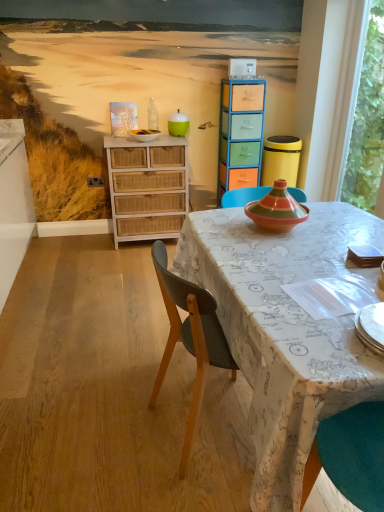
Identify the location of white glossy bowl at upper center. The height and width of the screenshot is (512, 384). (144, 135).

Find the location of a particular element. The width and height of the screenshot is (384, 512). white wicker dresser at left is located at coordinates (147, 187).

What do you see at coordinates (366, 119) in the screenshot?
I see `transparent glass window at right` at bounding box center [366, 119].

What do you see at coordinates (95, 181) in the screenshot? This screenshot has height=512, width=384. I see `black plastic power outlet at lower left` at bounding box center [95, 181].

What do you see at coordinates (153, 116) in the screenshot?
I see `translucent glass bottle at center` at bounding box center [153, 116].

Where is `multicolored painted drawers at center`? The height and width of the screenshot is (512, 384). multicolored painted drawers at center is located at coordinates (240, 134).

Is there a large distance between map-patterned fabric at center and transparent glass window at right?

Yes.

Based on the photo, between map-patterned fabric at center and transparent glass window at right, which one has less height?

map-patterned fabric at center.

Is map-patterned fabric at center located outside transparent glass window at right?

Yes.

In terms of height, does translucent glass bottle at center look taller or shorter compared to map-patterned fabric at center?

Considering their sizes, translucent glass bottle at center has less height than map-patterned fabric at center.

From the picture: Is translucent glass bottle at center to the left of map-patterned fabric at center from the viewer's perspective?

Correct, you'll find translucent glass bottle at center to the left of map-patterned fabric at center.

Who is smaller, translucent glass bottle at center or map-patterned fabric at center?

Smaller between the two is translucent glass bottle at center.

How different are the orientations of translucent glass bottle at center and map-patterned fabric at center in degrees?

translucent glass bottle at center and map-patterned fabric at center are facing 86 degrees away from each other.

What's the angular difference between black plastic power outlet at lower left and white plastic corded phone at upper center's facing directions?

The angular difference between black plastic power outlet at lower left and white plastic corded phone at upper center is 2.49 degrees.

From a real-world perspective, is black plastic power outlet at lower left on white plastic corded phone at upper center?

No, from a real-world perspective, black plastic power outlet at lower left is not above white plastic corded phone at upper center.

Does black plastic power outlet at lower left lie behind white plastic corded phone at upper center?

Yes.

You are a GUI agent. You are given a task and a screenshot of the screen. Output one action in this format:
    pyautogui.click(x=<x>, y=<y>)
    Task: Click on the power outlet on the left of white plastic corded phone at upper center
    This screenshot has height=512, width=384.
    Given the screenshot: What is the action you would take?
    pyautogui.click(x=95, y=181)

Which point is more distant from viewer, (364, 99) or (234, 73)?

The point (234, 73) is more distant.

Do you think transparent glass window at right is within white plastic corded phone at upper center, or outside of it?

transparent glass window at right cannot be found inside white plastic corded phone at upper center.

Find the location of `window screen in front of the white plastic corded phone at upper center`. window screen in front of the white plastic corded phone at upper center is located at coordinates (366, 119).

From the image's perspective, is multicolored painted drawers at center located above or below black plastic power outlet at lower left?

Based on their image positions, multicolored painted drawers at center is located above black plastic power outlet at lower left.

Where is `cabinetry that appears in front of the black plastic power outlet at lower left`? The height and width of the screenshot is (512, 384). cabinetry that appears in front of the black plastic power outlet at lower left is located at coordinates (240, 134).

Are multicolored painted drawers at center and black plastic power outlet at lower left beside each other?

multicolored painted drawers at center and black plastic power outlet at lower left are not in contact.

Does point (219, 129) come in front of point (99, 182)?

Yes, it is in front of point (99, 182).

From a real-world perspective, is translucent glass bottle at center below black plastic power outlet at lower left?

Actually, translucent glass bottle at center is physically above black plastic power outlet at lower left in the real world.

Is point (151, 102) less distant than point (89, 183)?

Yes, it is in front of point (89, 183).

In the scene shown: How distant is translucent glass bottle at center from black plastic power outlet at lower left?

They are 67.16 centimeters apart.

Does translucent glass bottle at center have a smaller size compared to black plastic power outlet at lower left?

No.

From a real-world perspective, which is physically above, white plastic corded phone at upper center or black plastic power outlet at lower left?

In real-world perspective, white plastic corded phone at upper center is above.

Where is `power outlet that is below the white plastic corded phone at upper center (from the image's perspective)`? This screenshot has width=384, height=512. power outlet that is below the white plastic corded phone at upper center (from the image's perspective) is located at coordinates (95, 181).

Between point (240, 67) and point (100, 184), which one is positioned in front?

The point (240, 67) is closer to the camera.

From the image's perspective, is white plastic corded phone at upper center located beneath black plastic power outlet at lower left?

No, from the image's perspective, white plastic corded phone at upper center is not below black plastic power outlet at lower left.

The width and height of the screenshot is (384, 512). What are the coordinates of `window screen above the map-patterned fabric at center (from the image's perspective)` in the screenshot? It's located at (366, 119).

You are a GUI agent. You are given a task and a screenshot of the screen. Output one action in this format:
    pyautogui.click(x=<x>, y=<y>)
    Task: Click on the bottle lying behind the map-patterned fabric at center
    
    Given the screenshot: What is the action you would take?
    pyautogui.click(x=153, y=116)

Which object lies further to the anchor point white plastic corded phone at upper center, multicolored painted drawers at center or transparent glass window at right?

transparent glass window at right.

Consider the image. Estimate the real-world distances between objects in this image. Which object is closer to black plastic power outlet at lower left, white glossy bowl at upper center or multicolored painted drawers at center?

white glossy bowl at upper center is closer to black plastic power outlet at lower left.

Which object lies further to the anchor point transparent glass window at right, black plastic power outlet at lower left or map-patterned fabric at center?

black plastic power outlet at lower left is positioned further to the anchor transparent glass window at right.

Which object lies nearer to the anchor point transparent glass window at right, black plastic power outlet at lower left or white plastic corded phone at upper center?

The object closer to transparent glass window at right is white plastic corded phone at upper center.

Which object lies further to the anchor point translucent glass bottle at center, white plastic corded phone at upper center or white wicker dresser at left?

Based on the image, white plastic corded phone at upper center appears to be further to translucent glass bottle at center.

Considering their positions, is multicolored painted drawers at center positioned further to transparent glass window at right than white plastic corded phone at upper center?

Based on the image, white plastic corded phone at upper center appears to be further to transparent glass window at right.

When comparing their distances from map-patterned fabric at center, does white wicker dresser at left or white glossy bowl at upper center seem further?

Based on the image, white glossy bowl at upper center appears to be further to map-patterned fabric at center.

When comparing their distances from transparent glass window at right, does white glossy bowl at upper center or multicolored painted drawers at center seem closer?

multicolored painted drawers at center lies closer to transparent glass window at right than the other object.

Where is `dresser positioned between map-patterned fabric at center and white glossy bowl at upper center from near to far`? The height and width of the screenshot is (512, 384). dresser positioned between map-patterned fabric at center and white glossy bowl at upper center from near to far is located at coordinates (147, 187).

The width and height of the screenshot is (384, 512). In order to click on cabinetry that lies between white plastic corded phone at upper center and white wicker dresser at left from top to bottom in this screenshot , I will do `click(240, 134)`.

Locate an element on the screen. The height and width of the screenshot is (512, 384). bowl between black plastic power outlet at lower left and multicolored painted drawers at center in the horizontal direction is located at coordinates (144, 135).

The width and height of the screenshot is (384, 512). Find the location of `window screen located between map-patterned fabric at center and multicolored painted drawers at center in the depth direction`. window screen located between map-patterned fabric at center and multicolored painted drawers at center in the depth direction is located at coordinates (366, 119).